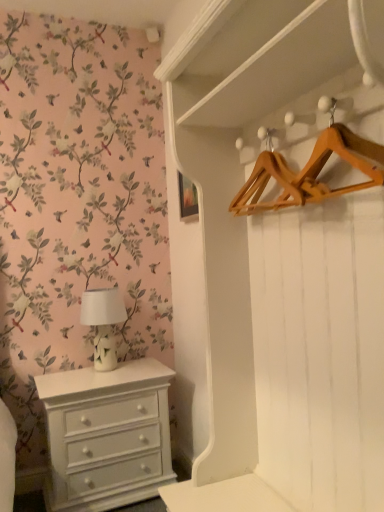
The width and height of the screenshot is (384, 512). What are the coordinates of `free space on the front side of white glossy table lamp at left` in the screenshot? It's located at [97, 381].